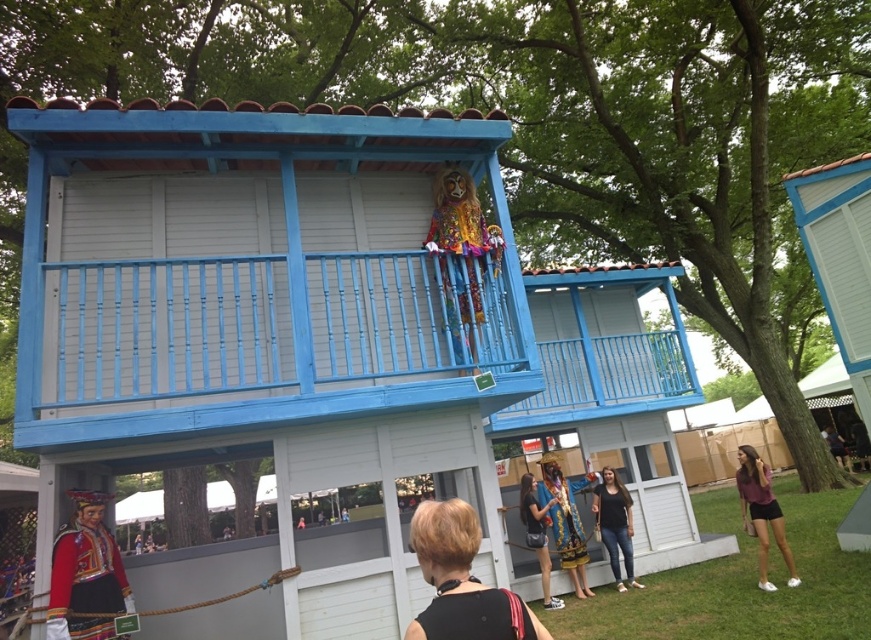
Is matte burgundy blouse at lower right smaller than jeans at center?

Incorrect, matte burgundy blouse at lower right is not smaller in size than jeans at center.

Where is `matte burgundy blouse at lower right`? The image size is (871, 640). matte burgundy blouse at lower right is located at coordinates (761, 513).

Does red velvet costume at lower left appear on the left side of matte burgundy blouse at lower right?

Yes, red velvet costume at lower left is to the left of matte burgundy blouse at lower right.

Find the location of a particular element. The height and width of the screenshot is (640, 871). red velvet costume at lower left is located at coordinates (86, 573).

You are a GUI agent. You are given a task and a screenshot of the screen. Output one action in this format:
    pyautogui.click(x=<x>, y=<y>)
    Task: Click on the red velvet costume at lower left
    The height and width of the screenshot is (640, 871).
    Given the screenshot: What is the action you would take?
    pyautogui.click(x=86, y=573)

Which is more to the right, short hair at center or gold metallic statue at center?

gold metallic statue at center

Is short hair at center shorter than gold metallic statue at center?

Yes, short hair at center is shorter than gold metallic statue at center.

Where is `short hair at center`? Image resolution: width=871 pixels, height=640 pixels. short hair at center is located at coordinates (461, 580).

At what (x,y) coordinates should I click in order to perform the action: click on short hair at center. Please return your answer as a coordinate pair (x, y). The height and width of the screenshot is (640, 871). Looking at the image, I should click on (461, 580).